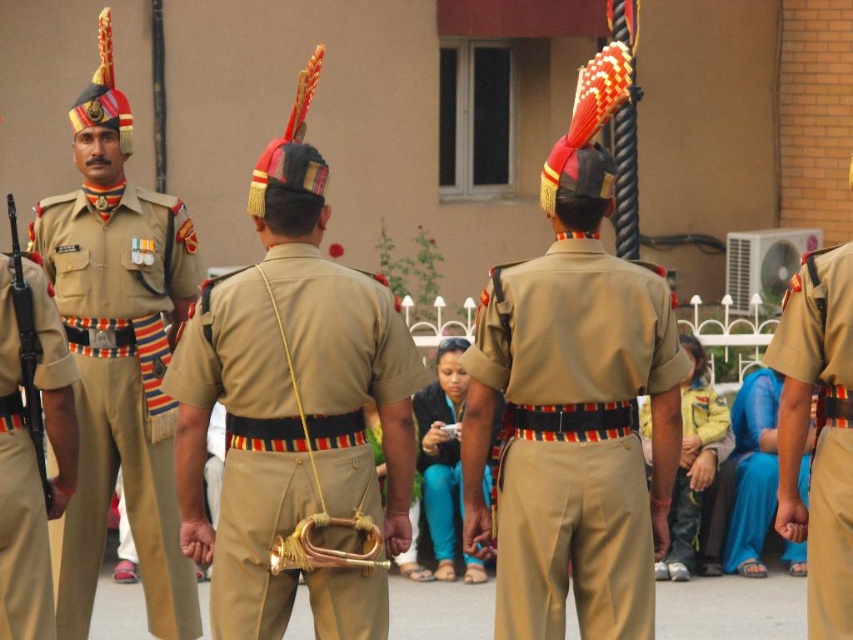
You are a photographer positioned at point A and want to take a photo of the two points mentioned in the scene. The first point is labeled as point (479, 474) and the second is point (369, 557). To ensure both points are visible in your photo, which point should you focus on first to avoid blocking the view of the other?

You should focus on point (369, 557) first because point (479, 474) is behind it. By focusing on the closer point, you can ensure that the farther point remains visible in the frame without obstruction.

You are a photographer trying to capture the matte khaki uniform at left. The camera you are using has a focus point at coordinate point (x=32, y=458). Will this focus point help you capture the matte khaki uniform at left?

Yes, the focus point at coordinate point (x=32, y=458) corresponds to the matte khaki uniform at left, so it will help you capture it.